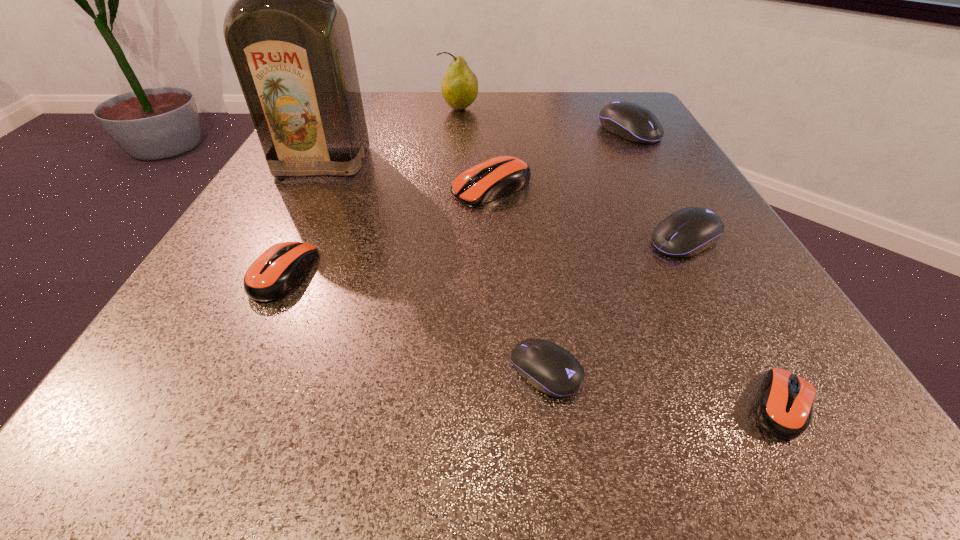
Image resolution: width=960 pixels, height=540 pixels. Identify the location of vacant space located on the right of the nearest black computer mouse. (742, 371).

The height and width of the screenshot is (540, 960). I want to click on vacant space located 0.120m on the back of the nearest orange computer mouse, so click(722, 295).

Where is `pear located at the far edge`? pear located at the far edge is located at coordinates (459, 87).

At what (x,y) coordinates should I click in order to perform the action: click on computer mouse at the far edge. Please return your answer as a coordinate pair (x, y). This screenshot has height=540, width=960. Looking at the image, I should click on (630, 121).

Find the location of a particular element. The image size is (960, 540). liquor located in the left edge section of the desktop is located at coordinates (290, 44).

Where is `computer mouse situated at the left edge`? The width and height of the screenshot is (960, 540). computer mouse situated at the left edge is located at coordinates (274, 273).

You are a GUI agent. You are given a task and a screenshot of the screen. Output one action in this format:
    pyautogui.click(x=<x>, y=<y>)
    Task: Click on the object that is at the far right corner
    This screenshot has width=960, height=540.
    Given the screenshot: What is the action you would take?
    pyautogui.click(x=630, y=121)

Identify the location of object that is at the near right corner. The width and height of the screenshot is (960, 540). (785, 408).

At what (x,y) coordinates should I click in order to perform the action: click on free space at the far edge of the desktop. Please return your answer as a coordinate pair (x, y). Looking at the image, I should click on (429, 129).

You are a GUI agent. You are given a task and a screenshot of the screen. Output one action in this format:
    pyautogui.click(x=<x>, y=<y>)
    Task: Click on the blank space at the near edge
    This screenshot has height=540, width=960.
    Given the screenshot: What is the action you would take?
    pyautogui.click(x=552, y=411)